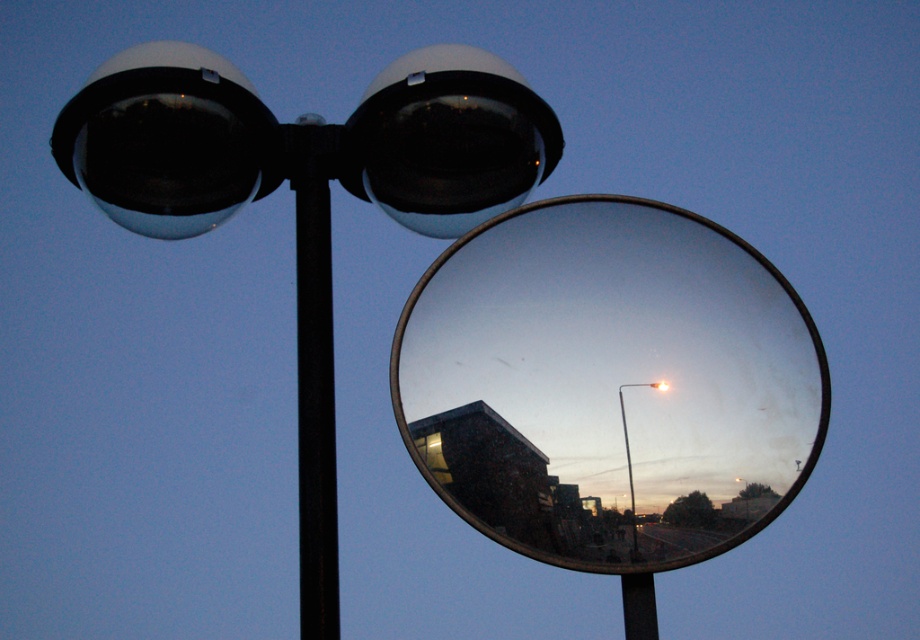
Question: Among these objects, which one is farthest from the camera?

Choices:
 (A) black metal pole at center
 (B) clear glass mirror at center
 (C) metallic silver street light at center
 (D) metallic silver pole at center

Answer: (C)

Question: Observing the image, what is the correct spatial positioning of matte black lamp post at upper center in reference to black metal pole at center?

Choices:
 (A) above
 (B) below

Answer: (A)

Question: Which point appears farthest from the camera in this image?

Choices:
 (A) (628, 481)
 (B) (745, 486)
 (C) (167, 147)

Answer: (C)

Question: Can you confirm if metallic silver pole at center is bigger than metallic silver street light at center?

Choices:
 (A) no
 (B) yes

Answer: (B)

Question: Among these objects, which one is nearest to the camera?

Choices:
 (A) metallic silver pole at center
 (B) matte black lamp post at upper center
 (C) black metal pole at center

Answer: (C)

Question: Is matte black lamp post at upper center positioned at the back of metallic silver pole at center?

Choices:
 (A) no
 (B) yes

Answer: (A)